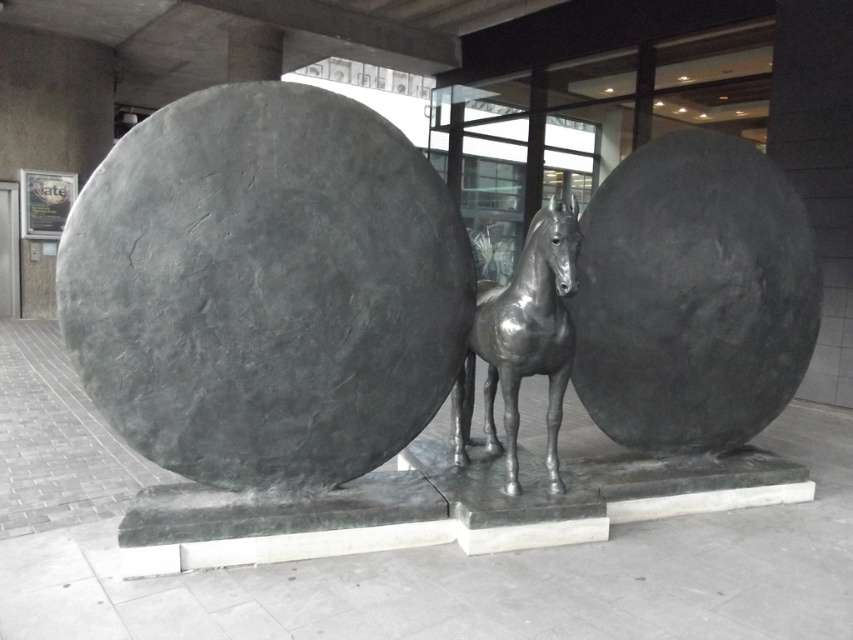
You are a maintenance worker tasked with placing a protective barrier around the bronze horse at center. The barrier must be placed exactly at the coordinates provided in the scene description. What are the coordinates where you should position the barrier?

The bronze horse at center is located at point (x=264, y=288), so you should position the barrier at those coordinates to ensure it surrounds the horse properly.